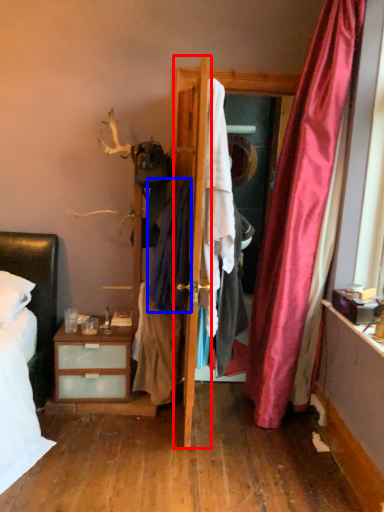
Question: Which object appears closest to the camera in this image, door (highlighted by a red box) or clothing (highlighted by a blue box)?

Choices:
 (A) door
 (B) clothing

Answer: (A)